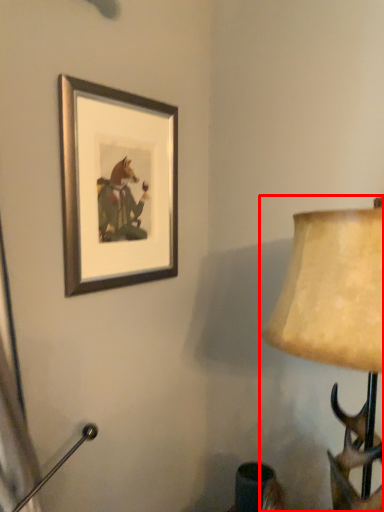
Question: From the image's perspective, where is lamp (annotated by the red box) located relative to picture frame?

Choices:
 (A) below
 (B) above

Answer: (A)